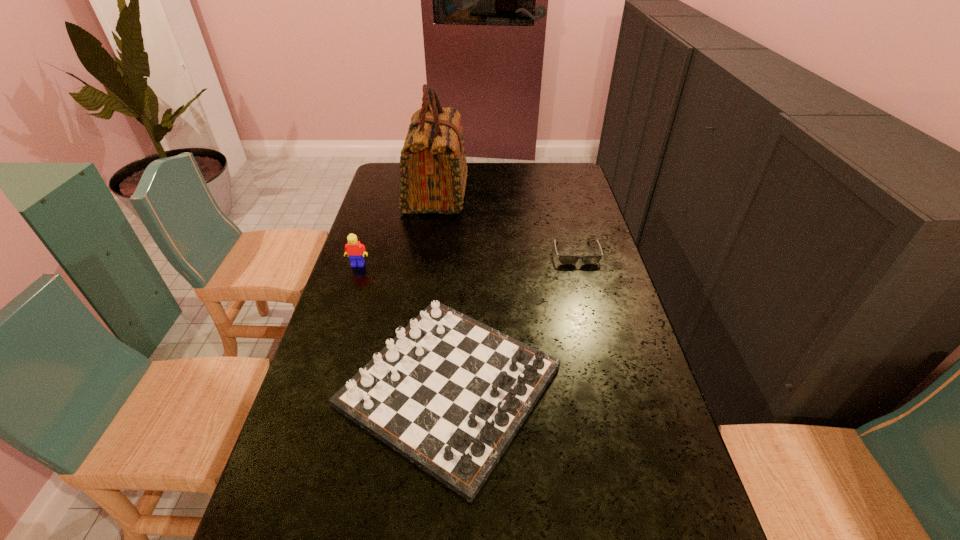
Find the location of `vacant space at the right edge of the desktop`. vacant space at the right edge of the desktop is located at coordinates [619, 410].

In the image, there is a desktop. Where is `vacant space at the far right corner`? This screenshot has width=960, height=540. vacant space at the far right corner is located at coordinates (566, 165).

Find the location of `empty location between the sunglasses and the Lego`. empty location between the sunglasses and the Lego is located at coordinates (467, 259).

Find the location of `empty location between the tallest object and the Lego`. empty location between the tallest object and the Lego is located at coordinates (397, 228).

At what (x,y) coordinates should I click in order to perform the action: click on free space between the shopping bag and the Lego. Please return your answer as a coordinate pair (x, y). The width and height of the screenshot is (960, 540). Looking at the image, I should click on (397, 228).

Image resolution: width=960 pixels, height=540 pixels. In order to click on empty space that is in between the chessboard and the sunglasses in this screenshot , I will do `click(513, 319)`.

Point out which object is positioned as the second nearest to the farthest object. Please provide its 2D coordinates. Your answer should be formatted as a tuple, i.e. [(x, y)], where the tuple contains the x and y coordinates of a point satisfying the conditions above.

[(564, 259)]

I want to click on object that is the third closest one to the third tallest object, so click(x=433, y=172).

Identify the location of vacant space that satisfies the following two spatial constraints: 1. on the open handle side of the farthest object; 2. on the front-facing side of the Lego. (426, 265).

Identify the location of vacant point that satisfies the following two spatial constraints: 1. on the open handle side of the shopping bag; 2. on the front-facing side of the third shortest object. (426, 265).